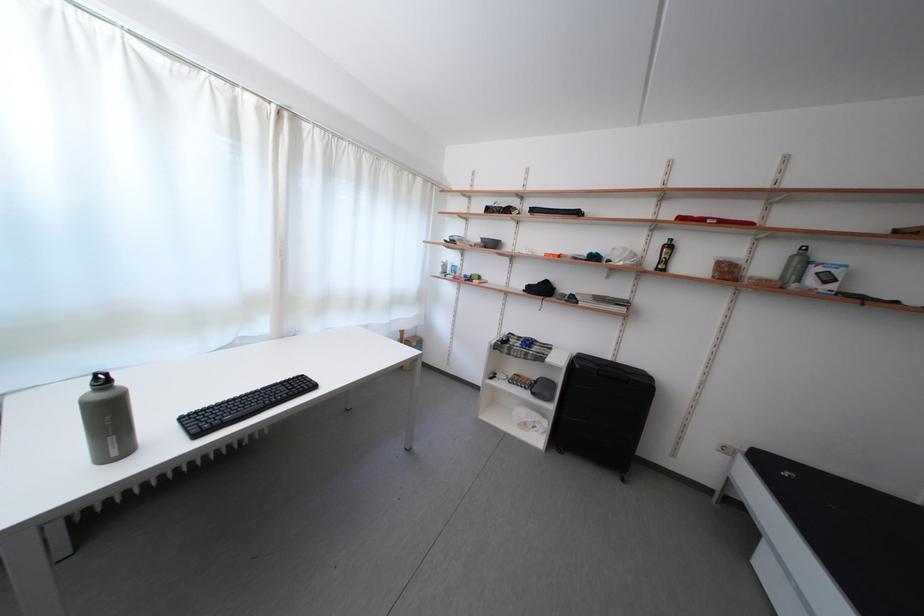
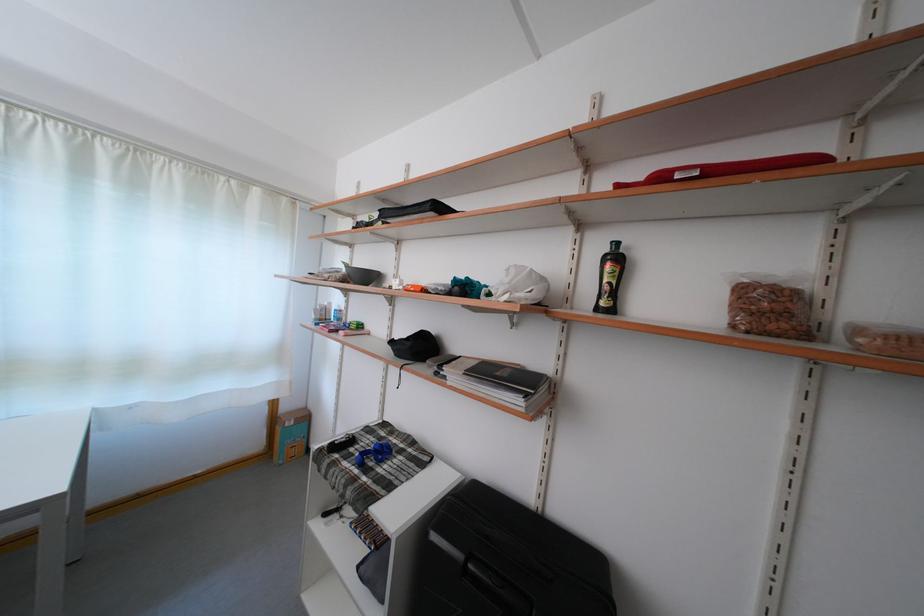
Where in the second image is the point corresponding to (x=665, y=275) from the first image?

(606, 314)